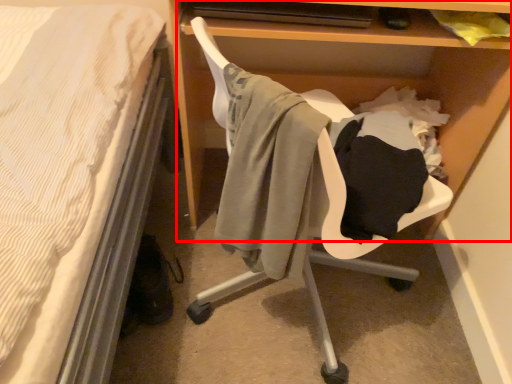
Question: In this image, where is shelf (annotated by the red box) located relative to swivel chair?

Choices:
 (A) right
 (B) left

Answer: (A)